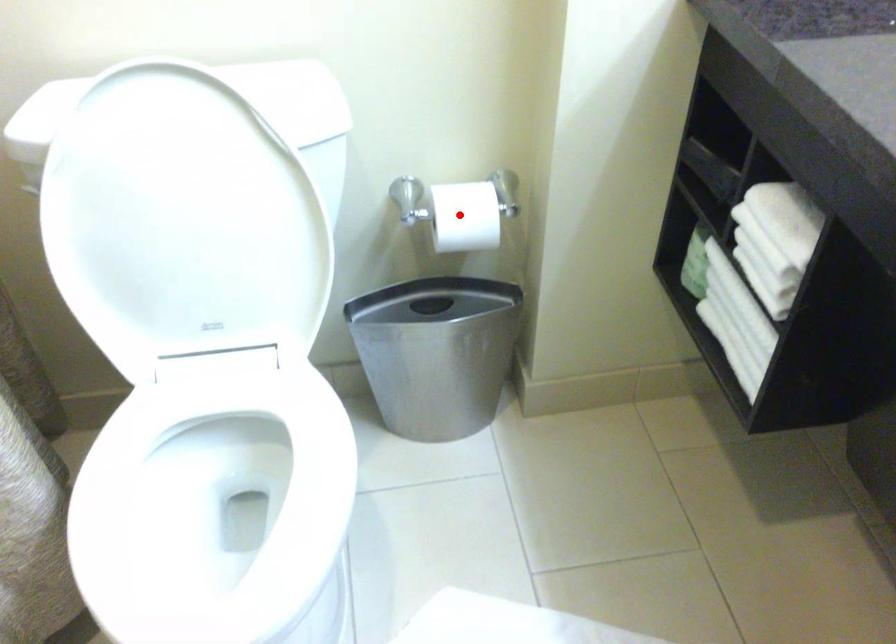
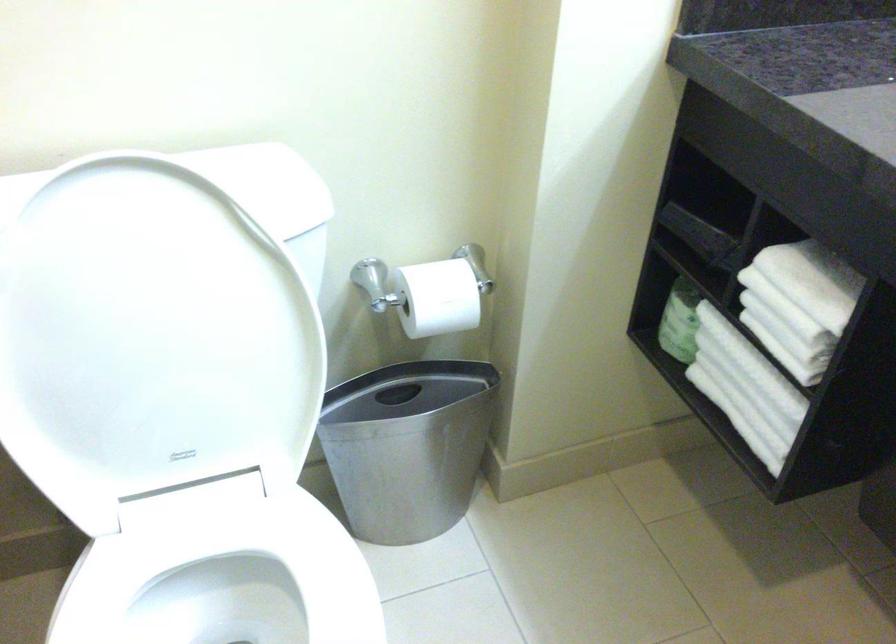
Find the pixel in the second image that matches the highlighted location in the first image.

(436, 298)